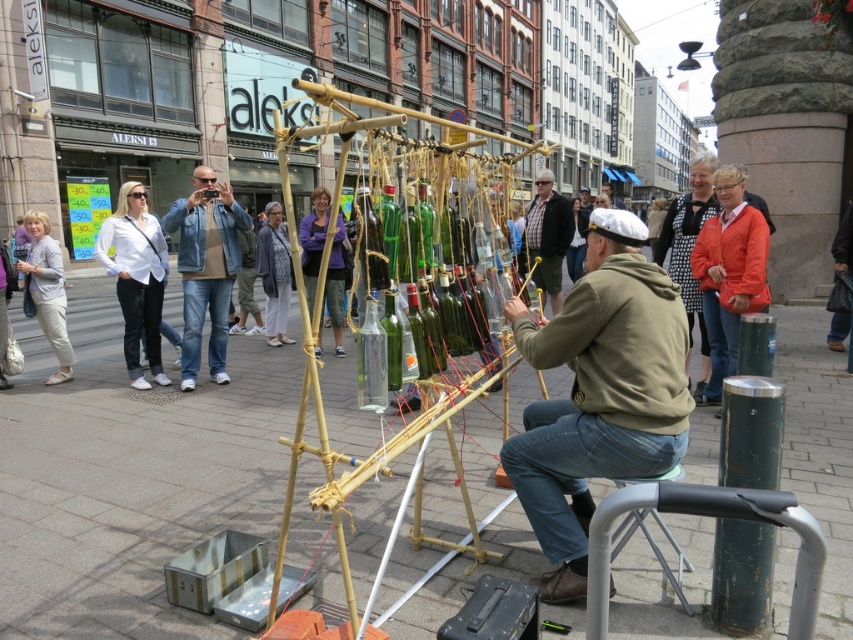
In the scene shown: Is light gray cotton pants at left to the left of purple fabric at center from the viewer's perspective?

Yes, light gray cotton pants at left is to the left of purple fabric at center.

Where is `light gray cotton pants at left`? light gray cotton pants at left is located at coordinates (45, 291).

The height and width of the screenshot is (640, 853). I want to click on light gray cotton pants at left, so click(x=45, y=291).

Who is higher up, khaki cotton jacket at center or purple fabric at center?

purple fabric at center is higher up.

What do you see at coordinates (598, 394) in the screenshot?
I see `khaki cotton jacket at center` at bounding box center [598, 394].

Locate an element on the screen. This screenshot has width=853, height=640. khaki cotton jacket at center is located at coordinates (598, 394).

Is orange fabric jacket at upper right to the left of light gray sweater at center from the viewer's perspective?

No, orange fabric jacket at upper right is not to the left of light gray sweater at center.

Based on the photo, can you confirm if orange fabric jacket at upper right is shorter than light gray sweater at center?

No, orange fabric jacket at upper right is not shorter than light gray sweater at center.

Identify the location of orange fabric jacket at upper right. (729, 273).

Where is `orange fabric jacket at upper right`? orange fabric jacket at upper right is located at coordinates (729, 273).